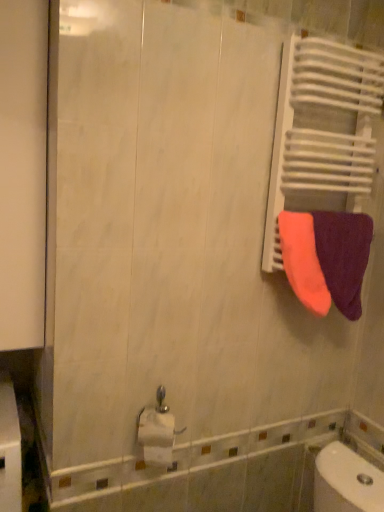
Question: Is neon orange fabric at right, positioned as the second towel in right-to-left order, in front of or behind orange terry cloth towel at right, which ranks as the 2th towel in left-to-right order, in the image?

Choices:
 (A) front
 (B) behind

Answer: (A)

Question: Is point (281, 249) positioned closer to the camera than point (339, 258)?

Choices:
 (A) closer
 (B) farther

Answer: (B)

Question: Which object is positioned farthest from the neon orange fabric at right, which is the 1th towel in left-to-right order?

Choices:
 (A) white glossy toilet paper at lower center
 (B) orange terry cloth towel at right, which ranks as the 1th towel in right-to-left order

Answer: (A)

Question: Based on their relative distances, which object is farther from the white glossy toilet paper at lower center?

Choices:
 (A) orange terry cloth towel at right, which ranks as the 1th towel in right-to-left order
 (B) neon orange fabric at right, which is the 1th towel in left-to-right order

Answer: (A)